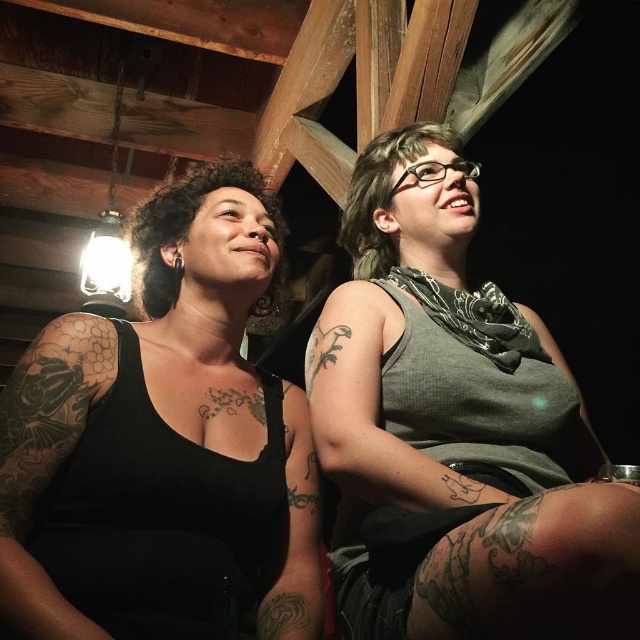
Measure the distance between black matte tank top at left and camera.

The distance of black matte tank top at left from camera is 32.05 inches.

Is black matte tank top at left positioned behind black tattooed arm at left?

Yes, black matte tank top at left is further from the viewer.

Between point (282, 234) and point (16, 371), which one is positioned in front?

Point (16, 371)

What are the coordinates of `black matte tank top at left` in the screenshot? It's located at (230, 371).

Can you confirm if gray matte tank top at center is taller than black matte tank top at left?

Indeed, gray matte tank top at center has a greater height compared to black matte tank top at left.

From the picture: Who is positioned more to the left, gray matte tank top at center or black matte tank top at left?

black matte tank top at left is more to the left.

Between point (508, 316) and point (275, 252), which one is positioned in front?

Point (275, 252)

Image resolution: width=640 pixels, height=640 pixels. Find the location of `gray matte tank top at center`. gray matte tank top at center is located at coordinates (456, 429).

Who is taller, gray matte tank top at center or black tattooed arm at left?

gray matte tank top at center is taller.

Describe the element at coordinates (456, 429) in the screenshot. I see `gray matte tank top at center` at that location.

At what (x,y) coordinates should I click in order to perform the action: click on gray matte tank top at center. Please return your answer as a coordinate pair (x, y). Looking at the image, I should click on (456, 429).